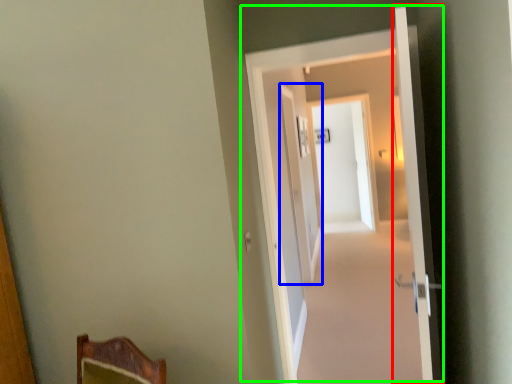
Question: Considering the real-world distances, which object is closest to door (highlighted by a red box)? screen door (highlighted by a blue box) or door (highlighted by a green box).

Choices:
 (A) screen door
 (B) door

Answer: (B)